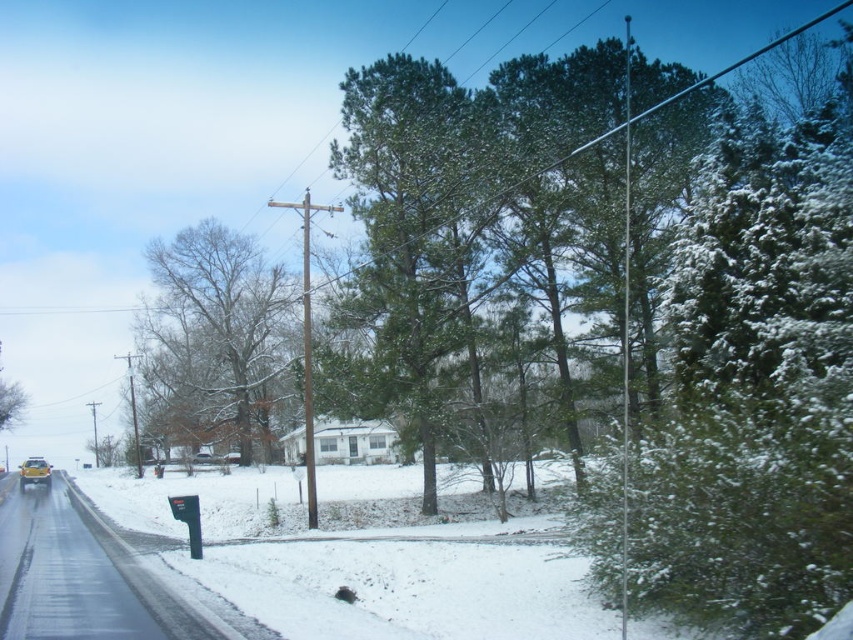
You are driving a car and want to park near the mailbox. The yellow matte car at lower left is already parked. Which direction should you turn to park next to the bare branches tree at center?

You should turn to the right to park next to the bare branches tree at center because it is located to the right of the yellow matte car at lower left.

What is located at the coordinates point (448, 209)?

The coordinates point (448, 209) corresponds to green needle leaves at center.